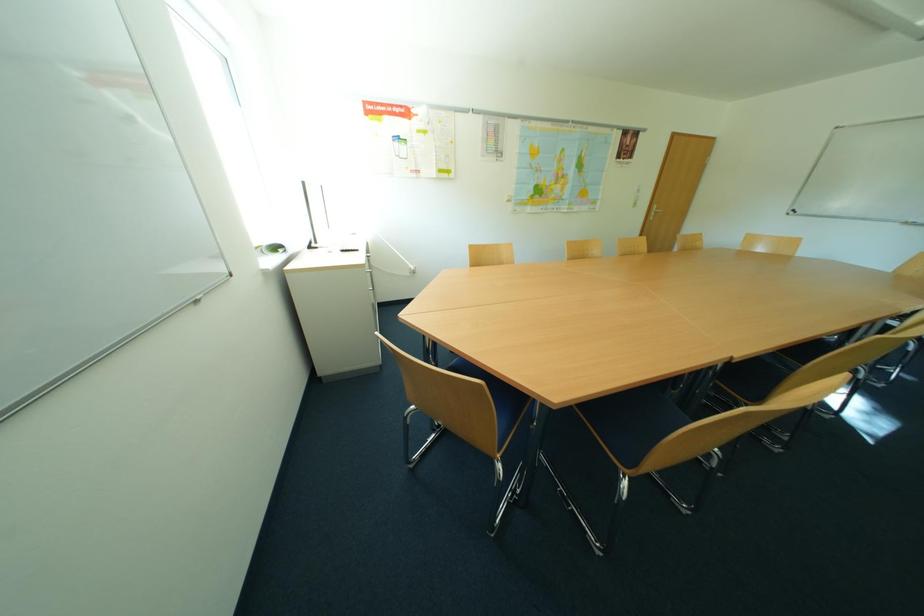
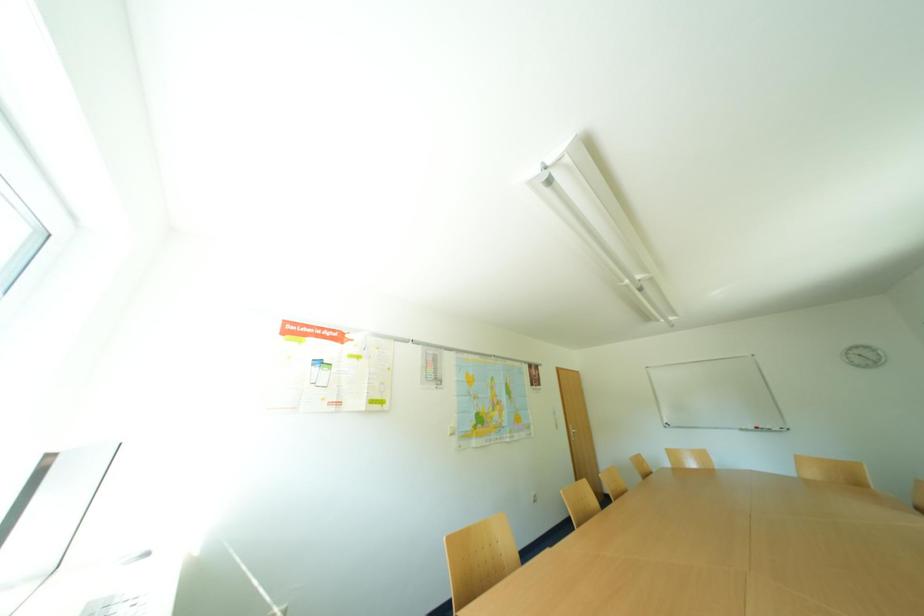
How did the camera likely rotate?

The camera's rotation is toward right-up.